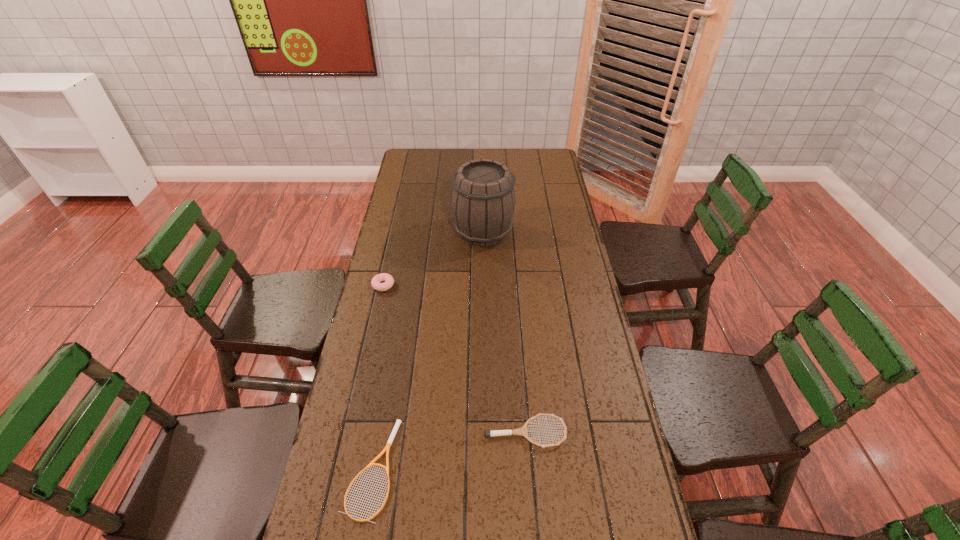
Identify the location of wine bucket. Image resolution: width=960 pixels, height=540 pixels. (483, 200).

I want to click on the tallest object, so click(483, 200).

Locate an element on the screen. Image resolution: width=960 pixels, height=540 pixels. the second farthest object is located at coordinates (389, 280).

Find the location of a particular element. The height and width of the screenshot is (540, 960). the third shortest object is located at coordinates (389, 280).

Where is `the second shortest object`? This screenshot has width=960, height=540. the second shortest object is located at coordinates [x=522, y=431].

At what (x,y) coordinates should I click in order to perform the action: click on the right tennis racket. Please return your answer as a coordinate pair (x, y). The height and width of the screenshot is (540, 960). Looking at the image, I should click on (522, 431).

The image size is (960, 540). Identify the location of the shorter tennis racket. (398, 422).

Locate an element on the screen. the shortest object is located at coordinates 398,422.

This screenshot has height=540, width=960. I want to click on vacant space located on the back of the tallest object, so click(x=483, y=179).

The width and height of the screenshot is (960, 540). Identify the location of blank space located 0.290m on the front of the second farthest object. (367, 361).